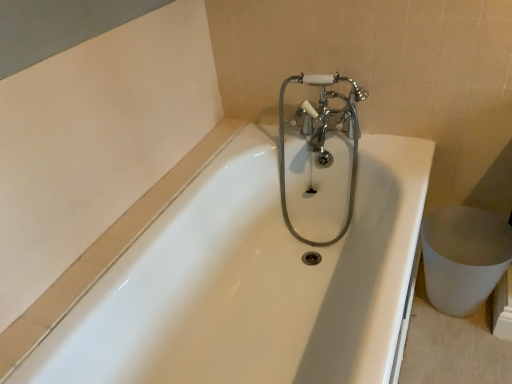
Question: Is the position of chrome/polished metal faucet at center less distant than that of white glossy bathtub at center?

Choices:
 (A) no
 (B) yes

Answer: (A)

Question: Is chrome/polished metal faucet at center behind white glossy bathtub at center?

Choices:
 (A) no
 (B) yes

Answer: (B)

Question: From the image's perspective, is chrome/polished metal faucet at center on top of white glossy bathtub at center?

Choices:
 (A) no
 (B) yes

Answer: (B)

Question: Considering the relative sizes of chrome/polished metal faucet at center and white glossy bathtub at center in the image provided, is chrome/polished metal faucet at center thinner than white glossy bathtub at center?

Choices:
 (A) yes
 (B) no

Answer: (A)

Question: Is white glossy bathtub at center surrounded by chrome/polished metal faucet at center?

Choices:
 (A) yes
 (B) no

Answer: (B)

Question: Can you confirm if chrome/polished metal faucet at center is shorter than white glossy bathtub at center?

Choices:
 (A) no
 (B) yes

Answer: (A)

Question: Considering the relative positions of white glossy bathtub at center and chrome/polished metal faucet at center in the image provided, is white glossy bathtub at center behind chrome/polished metal faucet at center?

Choices:
 (A) no
 (B) yes

Answer: (A)

Question: Is white glossy bathtub at center facing towards chrome/polished metal faucet at center?

Choices:
 (A) yes
 (B) no

Answer: (B)

Question: Does white glossy bathtub at center appear on the right side of chrome/polished metal faucet at center?

Choices:
 (A) yes
 (B) no

Answer: (B)

Question: Is chrome/polished metal faucet at center completely or partially inside white glossy bathtub at center?

Choices:
 (A) yes
 (B) no

Answer: (A)

Question: From a real-world perspective, is white glossy bathtub at center physically below chrome/polished metal faucet at center?

Choices:
 (A) yes
 (B) no

Answer: (A)

Question: From a real-world perspective, does white glossy bathtub at center stand above chrome/polished metal faucet at center?

Choices:
 (A) no
 (B) yes

Answer: (A)

Question: Considering the positions of white glossy bathtub at center and chrome/polished metal faucet at center in the image, is white glossy bathtub at center bigger or smaller than chrome/polished metal faucet at center?

Choices:
 (A) big
 (B) small

Answer: (A)